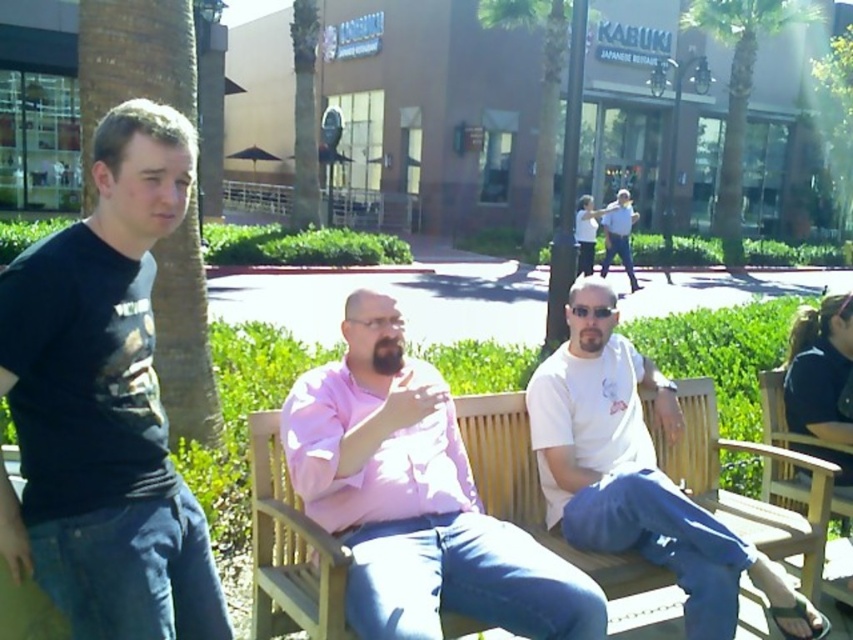
You are a photographer trying to capture a group photo of the pink matte shirt at center and the white cotton shirt at center. Since you want to ensure both subjects are in focus, you need to know which one is shorter. Can you tell me which one is shorter?

The pink matte shirt at center is shorter than the white cotton shirt at center according to the description.

You are a photographer setting up for a group photo. You have a camera with a 1.5 meter wide lens view. The white cotton shirt at center and wooden bench at center are in your frame. Can both objects fit within the camera view without any part being cut off?

The white cotton shirt at center might be wider than wooden bench at center. Since the camera view is 1.5 meters wide, it is uncertain if both can fit without being cut off as the width of the shirt is possibly exceeding the bench. Further measurement is needed.